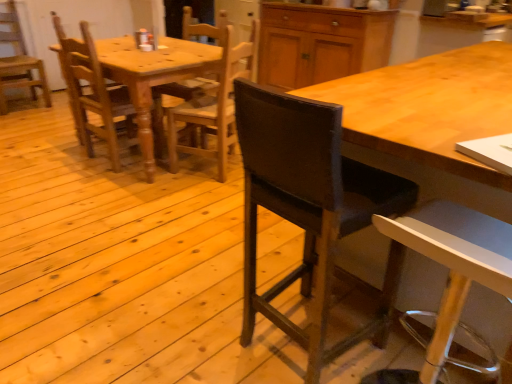
You are a GUI agent. You are given a task and a screenshot of the screen. Output one action in this format:
    pyautogui.click(x=<x>, y=<y>)
    Task: Click on the free location to the left of wooden chair at center, acting as the 4th chair starting from the front
    
    Given the screenshot: What is the action you would take?
    pyautogui.click(x=56, y=164)